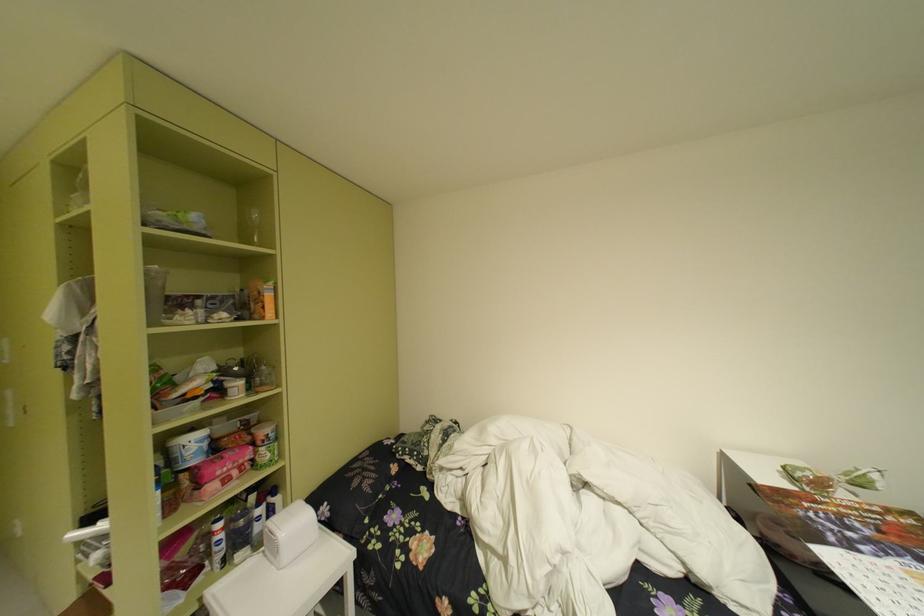
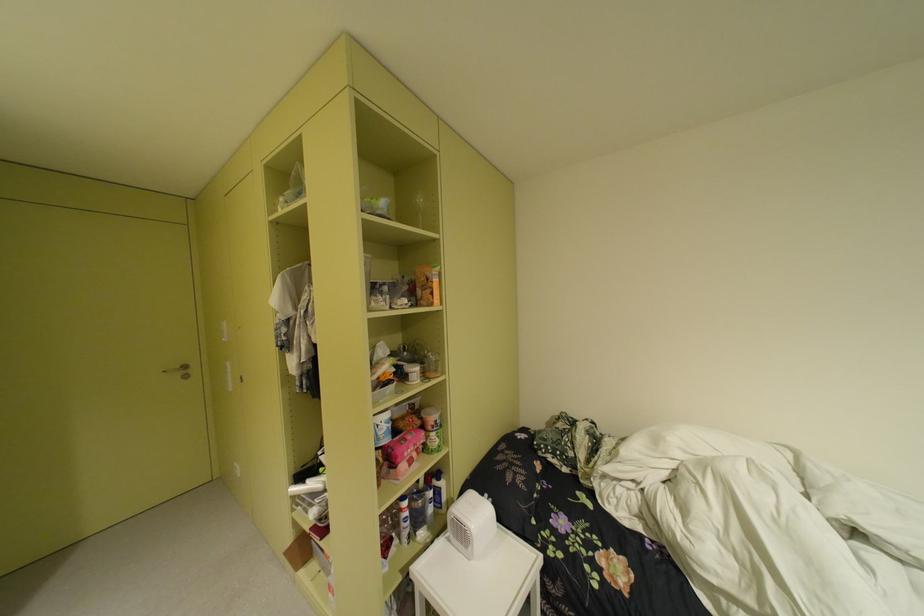
Locate, in the second image, the point that corresponds to [269,545] in the first image.

(451, 529)